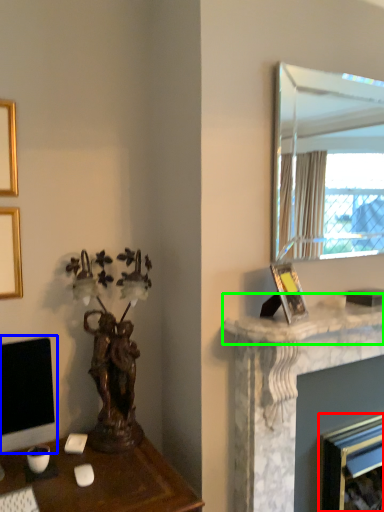
Question: Considering the real-world distances, which object is farthest from fireplace (highlighted by a red box)? computer monitor (highlighted by a blue box) or counter top (highlighted by a green box)?

Choices:
 (A) computer monitor
 (B) counter top

Answer: (A)